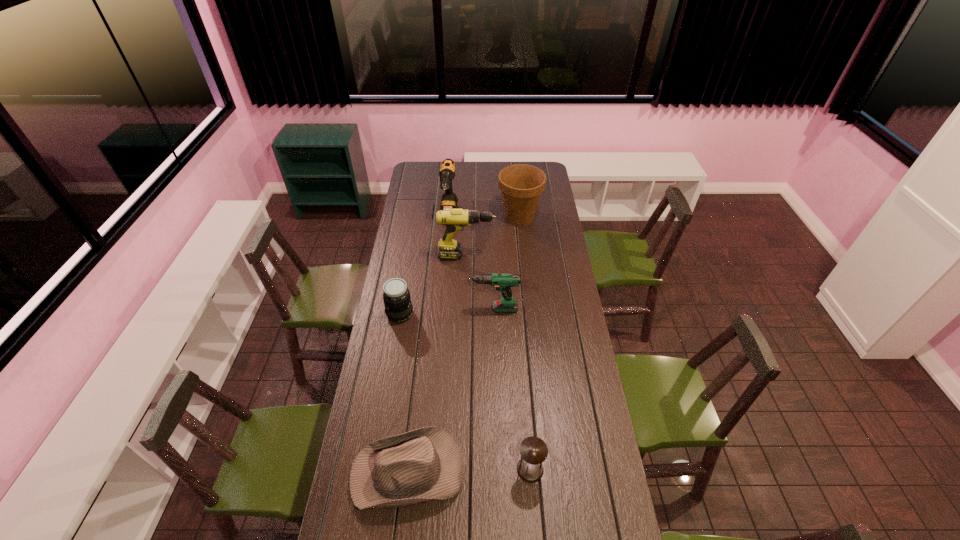
The image size is (960, 540). I want to click on the farthest drill, so click(x=449, y=201).

Where is `the fifth nearest object`? Image resolution: width=960 pixels, height=540 pixels. the fifth nearest object is located at coordinates (455, 219).

I want to click on flowerpot, so click(x=521, y=185).

Where is `the nearest drill`? The image size is (960, 540). the nearest drill is located at coordinates (503, 282).

Find the location of a particular element. Image resolution: width=960 pixels, height=540 pixels. the fourth shortest object is located at coordinates (503, 282).

This screenshot has height=540, width=960. What are the coordinates of `the fifth tallest object` in the screenshot? It's located at (398, 307).

Where is `hourglass`? The width and height of the screenshot is (960, 540). hourglass is located at coordinates (533, 450).

Locate an element on the screen. This screenshot has height=540, width=960. fedora is located at coordinates (415, 467).

This screenshot has width=960, height=540. Identify the location of free spot located 0.130m at the tip of the farthest drill. (446, 246).

I want to click on free spot located 0.270m on the handle side of the second farthest drill, so click(x=546, y=256).